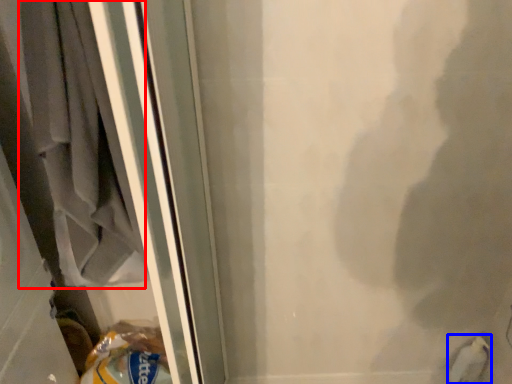
Question: Which of the following is the farthest to the observer, laundry (highlighted by a red box) or animal (highlighted by a blue box)?

Choices:
 (A) laundry
 (B) animal

Answer: (B)